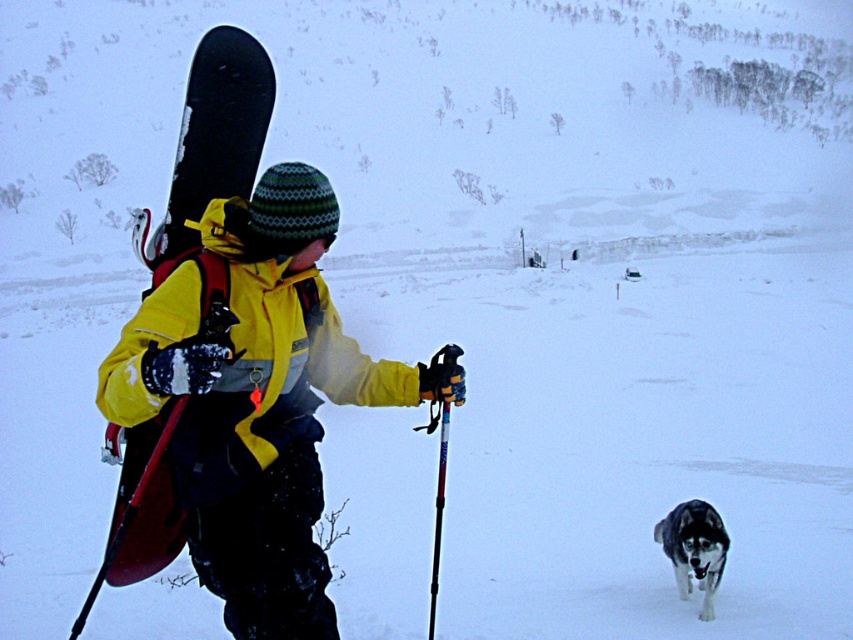
Question: Which of the following is the farthest from the observer?

Choices:
 (A) black fur dog at lower right
 (B) yellow matte jacket at center
 (C) matte black snowboard at left

Answer: (A)

Question: Based on their relative distances, which object is farther from the yellow matte jacket at center?

Choices:
 (A) matte black snowboard at left
 (B) black fur dog at lower right

Answer: (B)

Question: Is yellow matte jacket at center thinner than matte black snowboard at left?

Choices:
 (A) no
 (B) yes

Answer: (B)

Question: Is yellow matte jacket at center further to the viewer compared to matte black snowboard at left?

Choices:
 (A) yes
 (B) no

Answer: (B)

Question: Does yellow matte jacket at center appear over matte black snowboard at left?

Choices:
 (A) yes
 (B) no

Answer: (A)

Question: Which object is the farthest from the matte black snowboard at left?

Choices:
 (A) yellow matte jacket at center
 (B) black fur dog at lower right

Answer: (B)